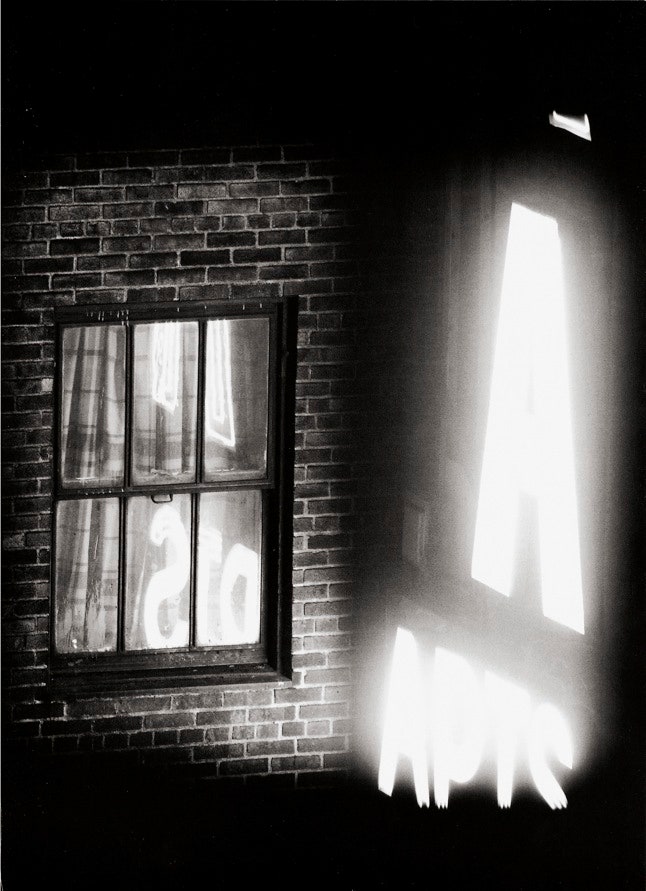
This screenshot has width=646, height=891. Identify the location of window frame. (271, 475).